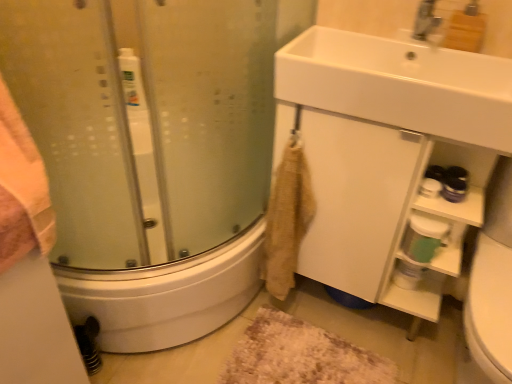
Where is `free region under brown shaggy bath mat at lower center (from a real-world perspective)`? The width and height of the screenshot is (512, 384). free region under brown shaggy bath mat at lower center (from a real-world perspective) is located at coordinates (295, 354).